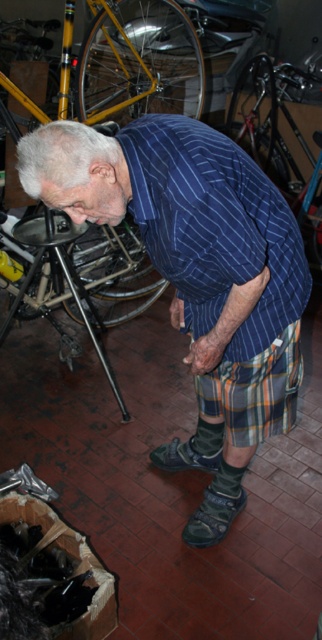
Does black metal bicycle at lower left have a smaller size compared to plaid fabric kilt at lower center?

Actually, black metal bicycle at lower left might be larger than plaid fabric kilt at lower center.

Is black metal bicycle at lower left closer to camera compared to plaid fabric kilt at lower center?

No, black metal bicycle at lower left is further to the viewer.

What do you see at coordinates (84, 276) in the screenshot? I see `black metal bicycle at lower left` at bounding box center [84, 276].

Identify the location of black metal bicycle at lower left. Image resolution: width=322 pixels, height=640 pixels. (84, 276).

Which of these two, blue striped shirt at center or yellow matte bicycle at upper left, stands taller?

blue striped shirt at center

Is blue striped shirt at center further to camera compared to yellow matte bicycle at upper left?

No, blue striped shirt at center is in front of yellow matte bicycle at upper left.

Where is `blue striped shirt at center`? blue striped shirt at center is located at coordinates (197, 260).

Between blue striped shirt at center and plaid fabric kilt at lower center, which one appears on the right side from the viewer's perspective?

From the viewer's perspective, plaid fabric kilt at lower center appears more on the right side.

Locate an element on the screen. The image size is (322, 640). blue striped shirt at center is located at coordinates (197, 260).